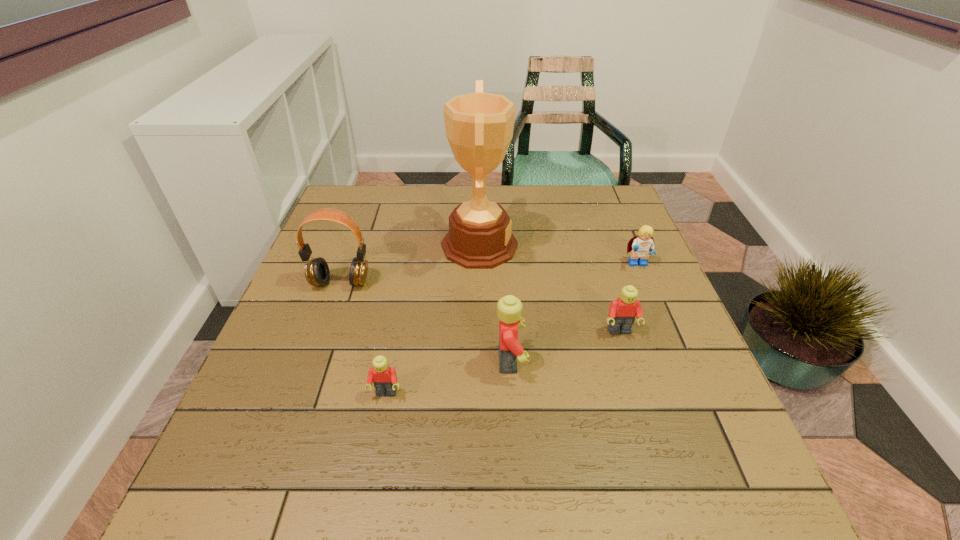
The width and height of the screenshot is (960, 540). In order to click on vacant area that lies between the tallest Lego and the shortest object in this screenshot , I will do `click(448, 377)`.

At what (x,y) coordinates should I click in order to perform the action: click on vacant area between the headset and the farthest Lego. Please return your answer as a coordinate pair (x, y). The width and height of the screenshot is (960, 540). Looking at the image, I should click on (490, 274).

You are a GUI agent. You are given a task and a screenshot of the screen. Output one action in this format:
    pyautogui.click(x=<x>, y=<y>)
    Task: Click on the object that can be found as the third closest to the farthest Lego
    
    Given the screenshot: What is the action you would take?
    pyautogui.click(x=509, y=308)

Identify which object is located as the third nearest to the second Lego from right to left. Please provide its 2D coordinates. Your answer should be formatted as a tuple, i.e. [(x, y)], where the tuple contains the x and y coordinates of a point satisfying the conditions above.

[(479, 126)]

I want to click on Lego object that ranks as the third closest to the leftmost object, so click(x=622, y=312).

This screenshot has height=540, width=960. In order to click on Lego that is the closest to the headset in this screenshot , I will do `click(384, 377)`.

I want to click on free space that satisfies the following two spatial constraints: 1. on the face of the third Lego from right to left; 2. on the face of the shortest object, so click(x=513, y=394).

In order to click on free location that satisfies the following two spatial constraints: 1. on the face of the third farthest Lego; 2. on the face of the shortest object in this screenshot , I will do `click(513, 394)`.

Image resolution: width=960 pixels, height=540 pixels. I want to click on vacant space that satisfies the following two spatial constraints: 1. on the front-facing side of the rightmost Lego; 2. on the face of the third Lego from right to left, so click(679, 361).

Where is `free space that satisfies the following two spatial constraints: 1. on the face of the second Lego from left to right; 2. on the face of the fifth object from right to left`? The width and height of the screenshot is (960, 540). free space that satisfies the following two spatial constraints: 1. on the face of the second Lego from left to right; 2. on the face of the fifth object from right to left is located at coordinates (513, 394).